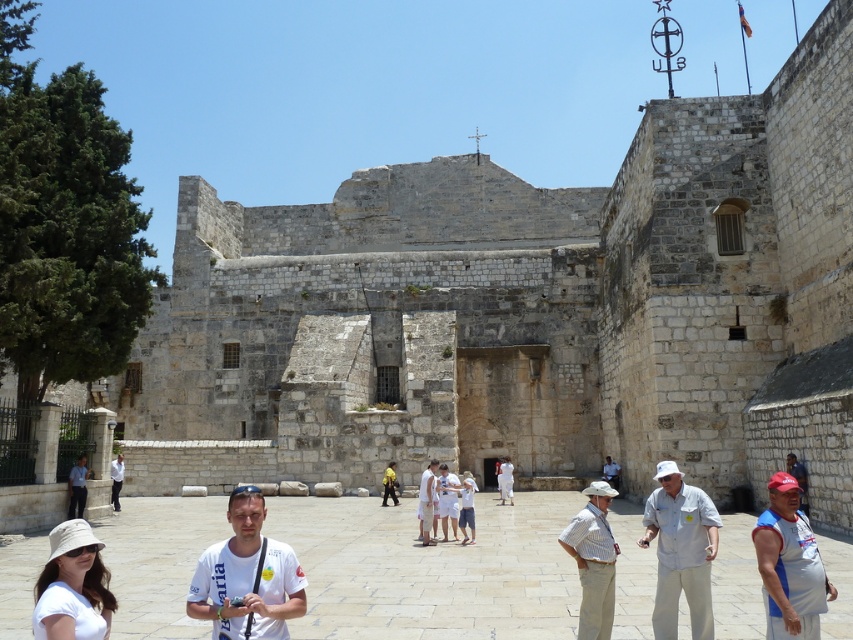
Can you confirm if white matte hat at lower left is bigger than yellow fabric backpack at center?

Indeed, white matte hat at lower left has a larger size compared to yellow fabric backpack at center.

Is white matte hat at lower left to the left of yellow fabric backpack at center from the viewer's perspective?

Correct, you'll find white matte hat at lower left to the left of yellow fabric backpack at center.

Measure the distance between white matte hat at lower left and camera.

white matte hat at lower left is 23.44 meters away from camera.

This screenshot has height=640, width=853. Identify the location of white matte hat at lower left. (73, 586).

Can you confirm if white matte hat at lower left is wider than light blue shirt at lower left?

Yes, white matte hat at lower left is wider than light blue shirt at lower left.

Who is positioned more to the left, white matte hat at lower left or light blue shirt at lower left?

Positioned to the left is light blue shirt at lower left.

This screenshot has height=640, width=853. I want to click on white matte hat at lower left, so click(x=73, y=586).

Can you confirm if stone amphitheater at center is wider than light blue shirt at lower left?

Indeed, stone amphitheater at center has a greater width compared to light blue shirt at lower left.

Locate an element on the screen. Image resolution: width=853 pixels, height=640 pixels. stone amphitheater at center is located at coordinates (527, 310).

Find the location of a particular element. stone amphitheater at center is located at coordinates (527, 310).